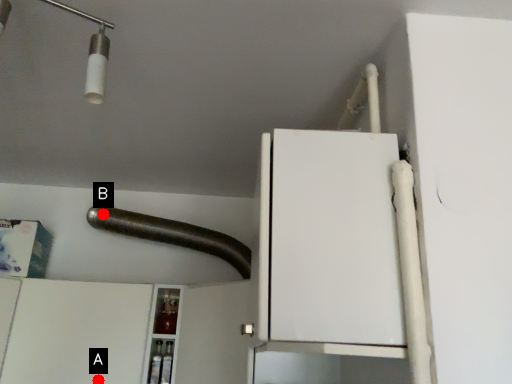
Question: Two points are circled on the image, labeled by A and B beside each circle. Which point is farther to the camera?

Choices:
 (A) A is further
 (B) B is further

Answer: (B)